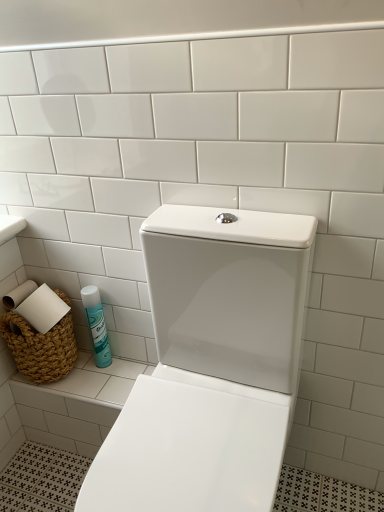
At what (x,y) coordinates should I click in order to perform the action: click on vacant space underneath braided wicker basket at lower left (from a real-world perspective). Please return your answer as a coordinate pair (x, y). This screenshot has height=512, width=384. Looking at the image, I should click on (61, 377).